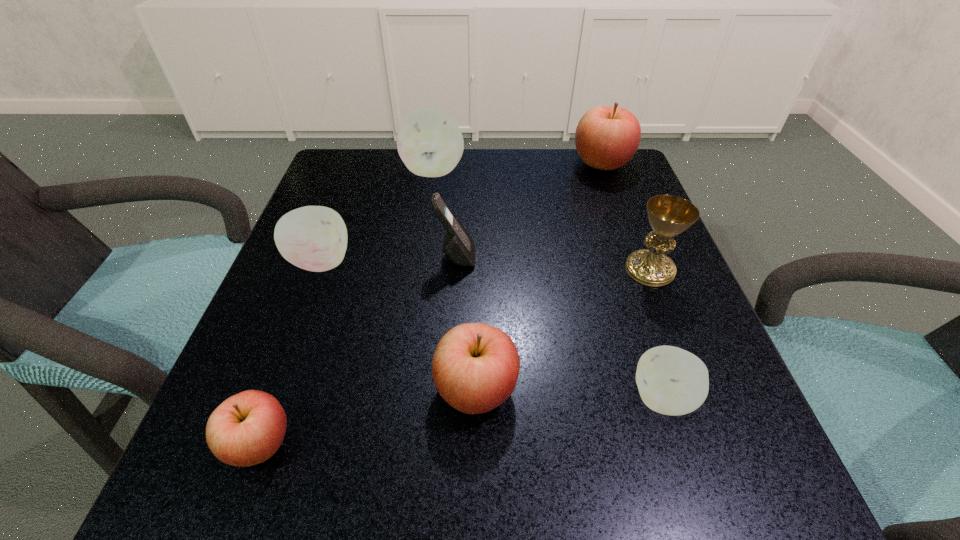
I want to click on object located in the near edge section of the desktop, so click(x=246, y=429).

The height and width of the screenshot is (540, 960). Find the location of `chalice at the right edge`. chalice at the right edge is located at coordinates (668, 215).

Identify the location of object that is at the near left corner. (246, 429).

At what (x,y) coordinates should I click in order to perform the action: click on object situated at the far right corner. Please return your answer as a coordinate pair (x, y). Looking at the image, I should click on (606, 138).

The image size is (960, 540). In the image, there is a desktop. Find the location of `free space at the far edge`. free space at the far edge is located at coordinates (565, 176).

This screenshot has width=960, height=540. In the image, there is a desktop. Find the location of `vacant space at the near edge`. vacant space at the near edge is located at coordinates (519, 507).

This screenshot has width=960, height=540. What are the coordinates of `vacant space at the left edge of the desktop` in the screenshot? It's located at (332, 287).

I want to click on vacant space at the right edge of the desktop, so click(x=596, y=218).

Find the location of `free space at the near left corner of the desktop`. free space at the near left corner of the desktop is located at coordinates (242, 501).

This screenshot has width=960, height=540. What are the coordinates of `vacant space at the far right corner of the desktop` in the screenshot? It's located at (632, 203).